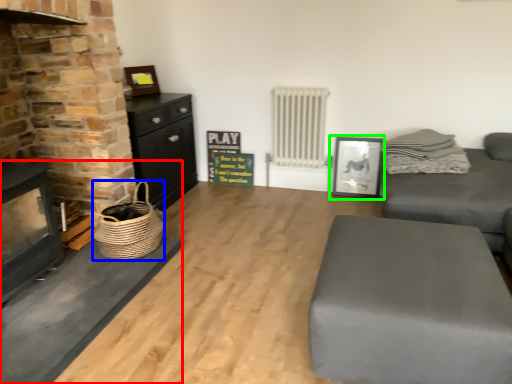
Question: Estimate the real-world distances between objects in this image. Which object is closer to fireplace (highlighted by a red box), basket (highlighted by a blue box) or picture frame (highlighted by a green box)?

Choices:
 (A) basket
 (B) picture frame

Answer: (A)